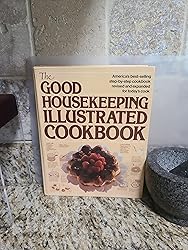
Locate an element on the screen. book is located at coordinates (113, 147).